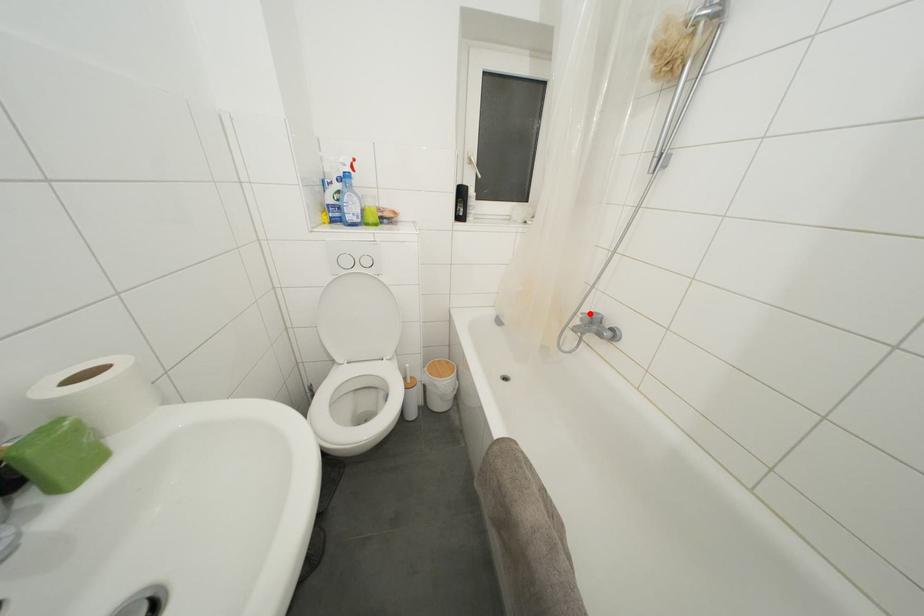
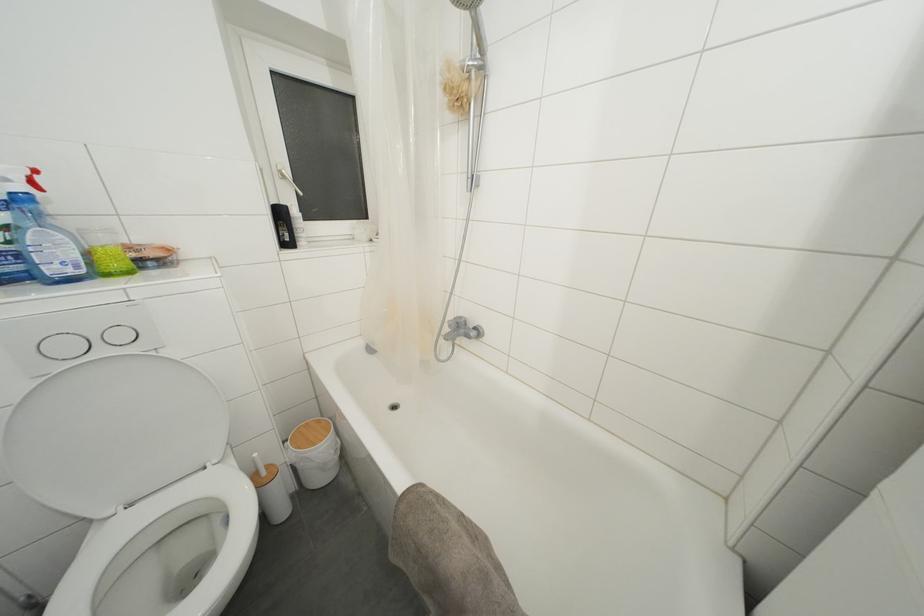
Question: I am providing you with two images of the same scene from different viewpoints. In image1, a red point is highlighted. Considering the same 3D point in image2, which of the following is correct?

Choices:
 (A) It is closer
 (B) It is farther

Answer: (B)